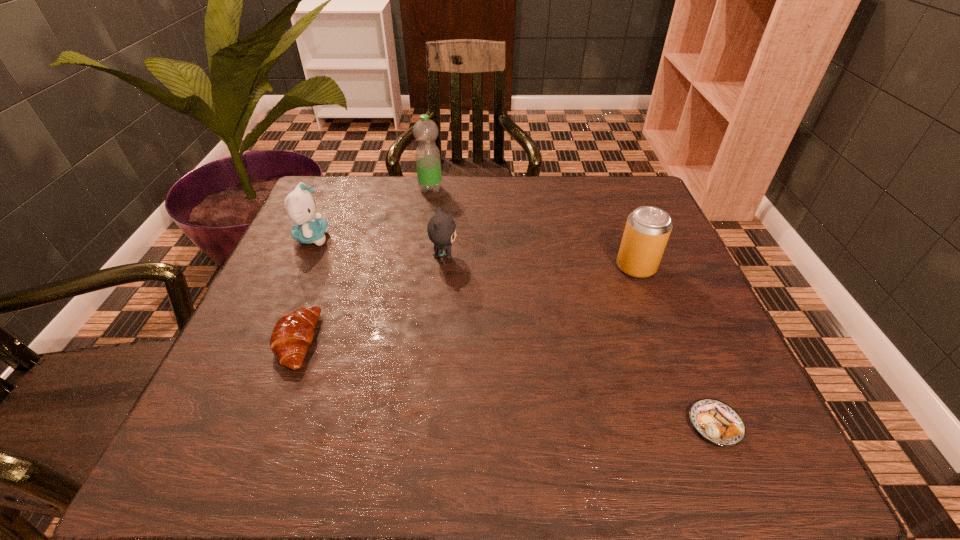
Where is `vacant position at the near left corner of the desktop`? The width and height of the screenshot is (960, 540). vacant position at the near left corner of the desktop is located at coordinates (209, 474).

In order to click on unoccupied position between the second nearest object and the right kitten in this screenshot , I will do `click(371, 299)`.

The image size is (960, 540). In order to click on vacant space that's between the left kitten and the farthest object in this screenshot , I will do `click(372, 213)`.

This screenshot has height=540, width=960. Identify the location of vacant space in between the taller kitten and the pastry. (514, 331).

Where is `vacant area between the pop (soda) and the farthest object`? vacant area between the pop (soda) and the farthest object is located at coordinates (533, 228).

The image size is (960, 540). What are the coordinates of `unoccupied area between the pop (soda) and the nearest object` in the screenshot? It's located at (676, 346).

Where is `vacant area between the water bottle and the crescent roll`? This screenshot has height=540, width=960. vacant area between the water bottle and the crescent roll is located at coordinates (364, 265).

Where is `vacant point located between the taller kitten and the shorter kitten`? vacant point located between the taller kitten and the shorter kitten is located at coordinates (378, 247).

Identify the location of free space between the third shortest object and the pop (soda). The image size is (960, 540). (540, 261).

The height and width of the screenshot is (540, 960). Find the location of `vacant space that's between the pastry and the crescent roll`. vacant space that's between the pastry and the crescent roll is located at coordinates (506, 383).